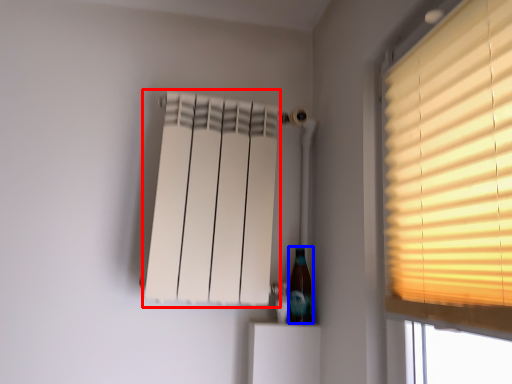
Question: Which object appears farthest to the camera in this image, curtain (highlighted by a red box) or bottle (highlighted by a blue box)?

Choices:
 (A) curtain
 (B) bottle

Answer: (B)